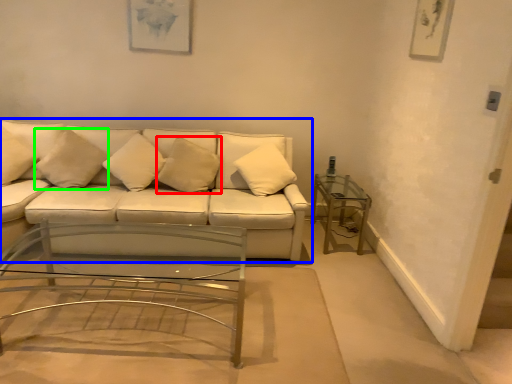
Question: Estimate the real-world distances between objects in this image. Which object is farther from pillow (highlighted by a red box), studio couch (highlighted by a blue box) or pillow (highlighted by a green box)?

Choices:
 (A) studio couch
 (B) pillow

Answer: (B)